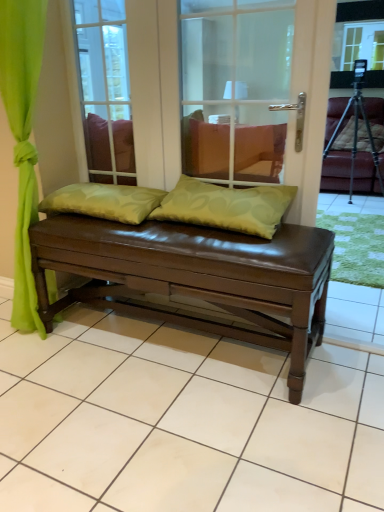
Question: Does green fabric pillow at center, the 2th pillow when ordered from left to right, come in front of green fabric pillow at center, the 1th pillow viewed from the left?

Choices:
 (A) yes
 (B) no

Answer: (A)

Question: From the image's perspective, is green fabric pillow at center, acting as the first pillow starting from the right, above green fabric pillow at center, the 1th pillow viewed from the left?

Choices:
 (A) no
 (B) yes

Answer: (A)

Question: Is green fabric pillow at center, the 2th pillow when ordered from left to right, to the right of green fabric pillow at center, which ranks as the second pillow in right-to-left order, from the viewer's perspective?

Choices:
 (A) no
 (B) yes

Answer: (B)

Question: Can you confirm if green fabric pillow at center, acting as the first pillow starting from the right, is taller than green fabric pillow at center, which ranks as the second pillow in right-to-left order?

Choices:
 (A) yes
 (B) no

Answer: (A)

Question: Considering the relative sizes of green fabric pillow at center, acting as the first pillow starting from the right, and green fabric pillow at center, the 1th pillow viewed from the left, in the image provided, is green fabric pillow at center, acting as the first pillow starting from the right, smaller than green fabric pillow at center, the 1th pillow viewed from the left,?

Choices:
 (A) no
 (B) yes

Answer: (A)

Question: In terms of width, does transparent glass door at center look wider or thinner when compared to brown leather bench at center?

Choices:
 (A) wide
 (B) thin

Answer: (B)

Question: From the image's perspective, is transparent glass door at center located above or below brown leather bench at center?

Choices:
 (A) below
 (B) above

Answer: (B)

Question: Is transparent glass door at center spatially inside brown leather bench at center, or outside of it?

Choices:
 (A) outside
 (B) inside

Answer: (A)

Question: Is transparent glass door at center in front of or behind brown leather bench at center in the image?

Choices:
 (A) front
 (B) behind

Answer: (B)

Question: Considering the positions of brown leather bench at center and transparent glass door at center in the image, is brown leather bench at center wider or thinner than transparent glass door at center?

Choices:
 (A) thin
 (B) wide

Answer: (B)

Question: From a real-world perspective, is brown leather bench at center above or below transparent glass door at center?

Choices:
 (A) below
 (B) above

Answer: (A)

Question: Considering the positions of point (182, 100) and point (117, 168), is point (182, 100) closer or farther from the camera than point (117, 168)?

Choices:
 (A) closer
 (B) farther

Answer: (A)

Question: Is brown leather bench at center situated inside transparent glass door at center or outside?

Choices:
 (A) outside
 (B) inside

Answer: (A)

Question: From their relative heights in the image, would you say leather armchair at right is taller or shorter than green fabric pillow at center, the 1th pillow viewed from the left?

Choices:
 (A) tall
 (B) short

Answer: (A)

Question: Is leather armchair at right in front of or behind green fabric pillow at center, which ranks as the second pillow in right-to-left order, in the image?

Choices:
 (A) behind
 (B) front

Answer: (A)